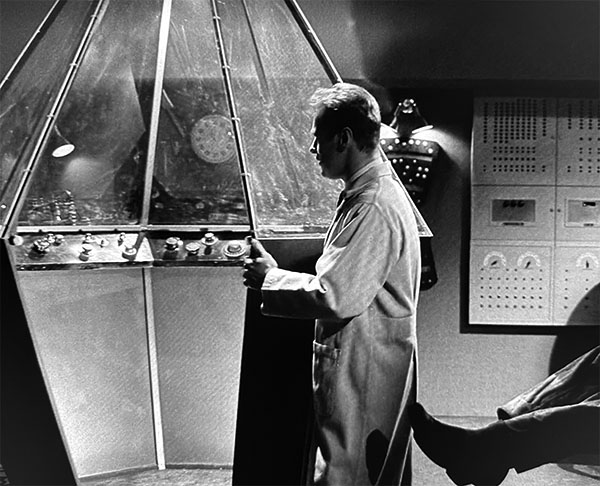
You are a GUI agent. You are given a task and a screenshot of the screen. Output one action in this format:
    pyautogui.click(x=<x>, y=<y>)
    Task: Click on the buttons of control panel left side
    The image size is (600, 486).
    Given the screenshot: What is the action you would take?
    pyautogui.click(x=135, y=254), pyautogui.click(x=102, y=242), pyautogui.click(x=85, y=251), pyautogui.click(x=84, y=232), pyautogui.click(x=118, y=239), pyautogui.click(x=44, y=239), pyautogui.click(x=57, y=235)